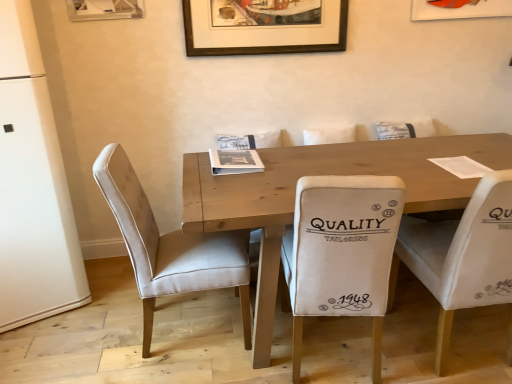
Question: Does brown wooden picture frame at upper center have a greater width compared to beige velvet chair at left, positioned as the 3th chair in right-to-left order?

Choices:
 (A) no
 (B) yes

Answer: (A)

Question: Does brown wooden picture frame at upper center come in front of beige velvet chair at left, positioned as the 3th chair in right-to-left order?

Choices:
 (A) no
 (B) yes

Answer: (A)

Question: Is brown wooden picture frame at upper center aimed at beige velvet chair at left, which is the first chair from left to right?

Choices:
 (A) yes
 (B) no

Answer: (B)

Question: Does brown wooden picture frame at upper center appear on the right side of beige velvet chair at left, which is the first chair from left to right?

Choices:
 (A) yes
 (B) no

Answer: (A)

Question: From a real-world perspective, is brown wooden picture frame at upper center physically below beige velvet chair at left, which is the first chair from left to right?

Choices:
 (A) no
 (B) yes

Answer: (A)

Question: Visually, is wooden table at center positioned to the left or to the right of beige fabric chair at center, the second chair in the right-to-left sequence?

Choices:
 (A) right
 (B) left

Answer: (A)

Question: Is wooden table at center inside or outside of beige fabric chair at center, positioned as the second chair in left-to-right order?

Choices:
 (A) outside
 (B) inside

Answer: (A)

Question: In terms of width, does wooden table at center look wider or thinner when compared to beige fabric chair at center, positioned as the second chair in left-to-right order?

Choices:
 (A) thin
 (B) wide

Answer: (B)

Question: Relative to beige fabric chair at center, the second chair in the right-to-left sequence, is wooden table at center in front or behind?

Choices:
 (A) behind
 (B) front

Answer: (A)

Question: Relative to wooden table at center, is brown wooden picture frame at upper center in front or behind?

Choices:
 (A) front
 (B) behind

Answer: (B)

Question: Would you say brown wooden picture frame at upper center is to the left or to the right of wooden table at center in the picture?

Choices:
 (A) right
 (B) left

Answer: (B)

Question: Is point (283, 52) positioned closer to the camera than point (397, 142)?

Choices:
 (A) closer
 (B) farther

Answer: (B)

Question: From a real-world perspective, relative to wooden table at center, is brown wooden picture frame at upper center vertically above or below?

Choices:
 (A) below
 (B) above

Answer: (B)

Question: In terms of width, does wooden table at center look wider or thinner when compared to white matte refrigerator at left?

Choices:
 (A) thin
 (B) wide

Answer: (B)

Question: Is wooden table at center bigger or smaller than white matte refrigerator at left?

Choices:
 (A) big
 (B) small

Answer: (A)